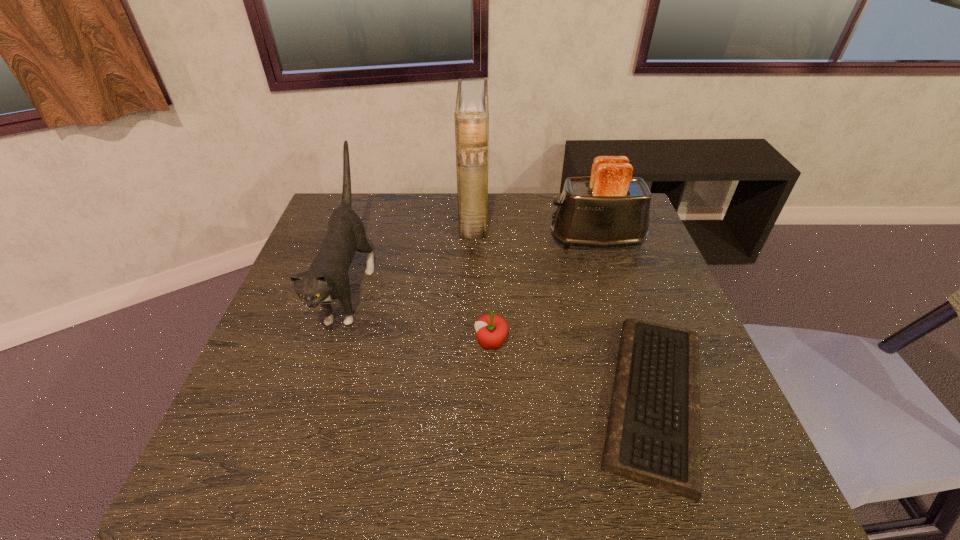
This screenshot has height=540, width=960. I want to click on object that is at the near right corner, so click(x=653, y=437).

What are the coordinates of `vacant space at the far edge of the desktop` in the screenshot? It's located at (396, 202).

I want to click on vacant space at the right edge of the desktop, so click(x=612, y=258).

Identify the location of free space at the far left corner of the desktop. This screenshot has height=540, width=960. (375, 198).

Image resolution: width=960 pixels, height=540 pixels. In order to click on vacant space that's between the computer keyboard and the apple in this screenshot , I will do `click(572, 371)`.

Image resolution: width=960 pixels, height=540 pixels. I want to click on empty location between the apple and the shortest object, so click(572, 371).

I want to click on unoccupied position between the shortest object and the toaster, so click(x=625, y=319).

Locate an element on the screen. This screenshot has width=960, height=540. vacant area that lies between the phonebook and the computer keyboard is located at coordinates (564, 308).

You are a GUI agent. You are given a task and a screenshot of the screen. Output one action in this format:
    pyautogui.click(x=<x>, y=<y>)
    Task: Click on the blank region between the toaster and the cat
    Image resolution: width=960 pixels, height=540 pixels.
    Given the screenshot: What is the action you would take?
    pyautogui.click(x=473, y=265)

I want to click on vacant space that is in between the third shortest object and the phonebook, so click(x=535, y=228).